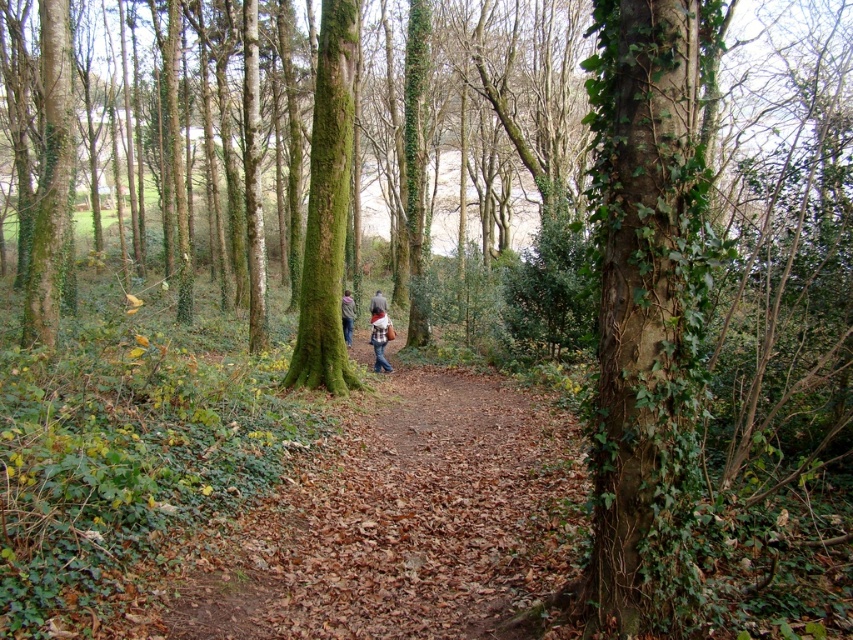
Can you confirm if denim jacket at center is taller than brown leather jacket at center?

Correct, denim jacket at center is much taller as brown leather jacket at center.

Which is more to the right, denim jacket at center or brown leather jacket at center?

Positioned to the right is denim jacket at center.

Does point (373, 308) lie behind point (370, 298)?

No.

You are a GUI agent. You are given a task and a screenshot of the screen. Output one action in this format:
    pyautogui.click(x=<x>, y=<y>)
    Task: Click on the denim jacket at center
    
    Given the screenshot: What is the action you would take?
    pyautogui.click(x=379, y=339)

Looking at this image, which is more to the right, green mossy tree at center or dark brown leather jacket at center?

green mossy tree at center is more to the right.

Describe the element at coordinates (328, 208) in the screenshot. I see `green mossy tree at center` at that location.

Is point (352, 35) in front of point (346, 324)?

Yes, it is.

Locate an element on the screen. This screenshot has width=853, height=640. green mossy tree at center is located at coordinates (328, 208).

Can you confirm if denim jacket at center is positioned to the left of dark brown leather jacket at center?

In fact, denim jacket at center is to the right of dark brown leather jacket at center.

Does denim jacket at center have a lesser height compared to dark brown leather jacket at center?

In fact, denim jacket at center may be taller than dark brown leather jacket at center.

Which is in front, point (386, 326) or point (349, 300)?

Point (386, 326) is in front.

Locate an element on the screen. The height and width of the screenshot is (640, 853). denim jacket at center is located at coordinates (379, 339).